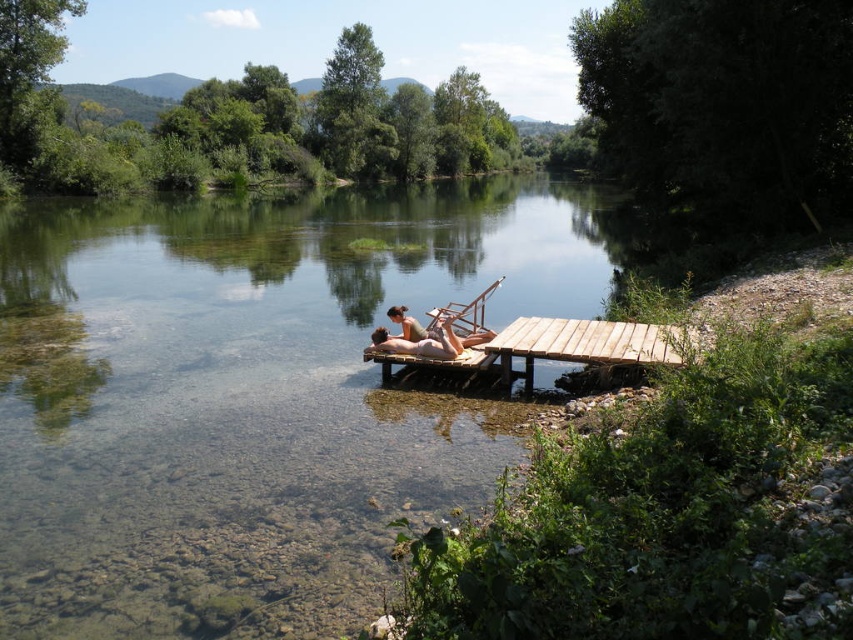
Can you confirm if wooden dock at center is positioned below smooth tan skin at center?

Correct, wooden dock at center is located below smooth tan skin at center.

Which is in front, point (512, 339) or point (386, 336)?

Point (512, 339) is more forward.

Which is behind, point (645, 324) or point (428, 355)?

Point (645, 324)

The width and height of the screenshot is (853, 640). I want to click on wooden dock at center, so click(x=585, y=342).

Is point (4, 442) closer to camera compared to point (675, 339)?

Yes, point (4, 442) is in front of point (675, 339).

The width and height of the screenshot is (853, 640). Find the location of `clear water at center`. clear water at center is located at coordinates (248, 397).

Based on the photo, can you confirm if clear water at center is positioned to the left of smooth tan skin at center?

Indeed, clear water at center is positioned on the left side of smooth tan skin at center.

Between point (225, 202) and point (461, 337), which one is positioned behind?

The point (225, 202) is behind.

The image size is (853, 640). I want to click on clear water at center, so click(x=248, y=397).